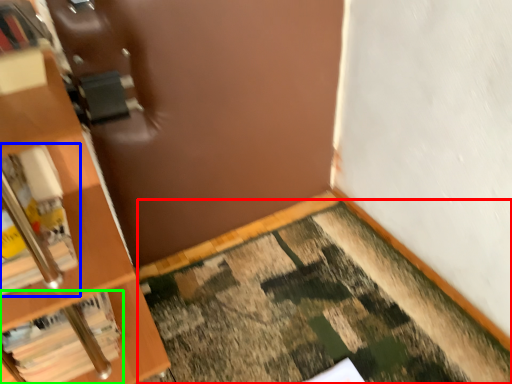
Question: Which object is the farthest from doormat (highlighted by a red box)? Choose among these: book (highlighted by a blue box) or book (highlighted by a green box).

Choices:
 (A) book
 (B) book

Answer: (A)